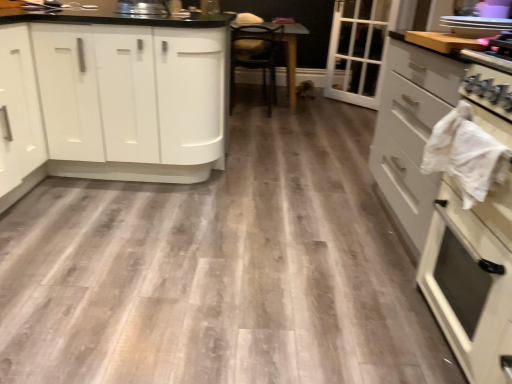
The height and width of the screenshot is (384, 512). I want to click on white glossy cabinets at left, which ranks as the 2th cabinetry in right-to-left order, so click(x=114, y=96).

You are a GUI agent. You are given a task and a screenshot of the screen. Output one action in this format:
    pyautogui.click(x=<x>, y=<y>)
    Task: Click on the white glossy oven at right, acting as the second cabinetry starting from the back
    
    Given the screenshot: What is the action you would take?
    pyautogui.click(x=443, y=207)

Image resolution: width=512 pixels, height=384 pixels. What do you see at coordinates (357, 50) in the screenshot?
I see `white glass door at upper right` at bounding box center [357, 50].

Locate an element on the screen. This screenshot has width=512, height=384. white glossy cabinets at left, the first cabinetry in the top-to-bottom sequence is located at coordinates (114, 96).

Is wooden table at center situated inside white glossy plates at upper right or outside?

wooden table at center cannot be found inside white glossy plates at upper right.

Does point (290, 79) lie in front of point (503, 31)?

No, it is not.

From the image's perspective, is wooden table at center positioned above or below white glossy plates at upper right?

Clearly, from the image's perspective, wooden table at center is above white glossy plates at upper right.

Considering the sizes of wooden table at center and white glossy plates at upper right in the image, is wooden table at center wider or thinner than white glossy plates at upper right?

Considering their sizes, wooden table at center looks broader than white glossy plates at upper right.

Is white glossy cabinets at left, the first cabinetry from the back, looking in the opposite direction of white glass door at upper right?

No, white glossy cabinets at left, the first cabinetry from the back, is not facing the opposite direction of white glass door at upper right.

Can you confirm if white glossy cabinets at left, the first cabinetry from the back, is wider than white glass door at upper right?

Indeed, white glossy cabinets at left, the first cabinetry from the back, has a greater width compared to white glass door at upper right.

Considering the relative sizes of white glossy cabinets at left, the first cabinetry from the back, and white glass door at upper right in the image provided, is white glossy cabinets at left, the first cabinetry from the back, taller than white glass door at upper right?

In fact, white glossy cabinets at left, the first cabinetry from the back, may be shorter than white glass door at upper right.

Consider the image. Measure the distance from white glossy cabinets at left, the second cabinetry ordered from the bottom, to white glass door at upper right.

The distance of white glossy cabinets at left, the second cabinetry ordered from the bottom, from white glass door at upper right is 9.10 feet.

Considering the positions of points (286, 47) and (209, 120), is point (286, 47) farther from camera compared to point (209, 120)?

Yes, point (286, 47) is farther from viewer.

From the picture: From the image's perspective, is wooden table at center on top of white glossy cabinets at left, the first cabinetry from the back?

Yes, from the image's perspective, wooden table at center is above white glossy cabinets at left, the first cabinetry from the back.

From a real-world perspective, who is located lower, wooden table at center or white glossy cabinets at left, which ranks as the 2th cabinetry in right-to-left order?

wooden table at center.

Is wooden table at center oriented away from white glossy cabinets at left, which ranks as the 2th cabinetry in right-to-left order?

No, wooden table at center's orientation is not away from white glossy cabinets at left, which ranks as the 2th cabinetry in right-to-left order.

Is white glass door at upper right positioned before white glossy plates at upper right?

No.

Is white glass door at upper right facing away from white glossy plates at upper right?

No, white glass door at upper right's orientation is not away from white glossy plates at upper right.

Is white glass door at upper right far from white glossy plates at upper right?

white glass door at upper right is positioned a significant distance from white glossy plates at upper right.

Considering the positions of objects white glass door at upper right and white glossy plates at upper right in the image provided, who is more to the left, white glass door at upper right or white glossy plates at upper right?

Positioned to the left is white glossy plates at upper right.

Is wooden table at center a part of white glossy oven at right, placed as the 1th cabinetry when sorted from front to back?

No, wooden table at center is not inside white glossy oven at right, placed as the 1th cabinetry when sorted from front to back.

Which object is thinner, white glossy oven at right, which is counted as the second cabinetry, starting from the top, or wooden table at center?

white glossy oven at right, which is counted as the second cabinetry, starting from the top, is thinner.

Is white glossy oven at right, acting as the second cabinetry starting from the back, not near wooden table at center?

Indeed, white glossy oven at right, acting as the second cabinetry starting from the back, is not near wooden table at center.

Considering the sizes of objects white glossy oven at right, which is counted as the second cabinetry, starting from the top, and wooden table at center in the image provided, who is shorter, white glossy oven at right, which is counted as the second cabinetry, starting from the top, or wooden table at center?

wooden table at center is shorter.

Is point (293, 33) positioned before point (332, 57)?

Yes, point (293, 33) is closer to viewer.

Image resolution: width=512 pixels, height=384 pixels. What are the coordinates of `table below the white glass door at upper right (from the image's perspective)` in the screenshot? It's located at (292, 58).

Which object is positioned more to the right, wooden table at center or white glass door at upper right?

Positioned to the right is white glass door at upper right.

Is wooden table at center positioned with its back to white glass door at upper right?

wooden table at center does not have its back to white glass door at upper right.

Can you confirm if white glass door at upper right is bigger than wooden table at center?

No, white glass door at upper right is not bigger than wooden table at center.

Considering the positions of point (367, 99) and point (286, 55), is point (367, 99) closer or farther from the camera than point (286, 55)?

Point (367, 99) appears to be farther away from the viewer than point (286, 55).

Is white glass door at upper right in front of or behind wooden table at center in the image?

Visually, white glass door at upper right is located behind wooden table at center.

Is white glass door at upper right positioned far away from wooden table at center?

No, white glass door at upper right is in close proximity to wooden table at center.

Where is `kitchen appliance in front of the wooden table at center`? kitchen appliance in front of the wooden table at center is located at coordinates (476, 26).

There is a white glass door at upper right. Where is `the 1st cabinetry below it (from a real-world perspective)`? the 1st cabinetry below it (from a real-world perspective) is located at coordinates (114, 96).

Based on their spatial positions, is white glossy plates at upper right or wooden table at center closer to white glossy cabinets at left, which ranks as the 2th cabinetry in right-to-left order?

white glossy plates at upper right is closer to white glossy cabinets at left, which ranks as the 2th cabinetry in right-to-left order.

Consider the image. Which object lies further to the anchor point wooden table at center, white glass door at upper right or white glossy cabinets at left, the 1th cabinetry positioned from the left?

Among the two, white glossy cabinets at left, the 1th cabinetry positioned from the left, is located further to wooden table at center.

Looking at the image, which one is located closer to white glossy cabinets at left, the second cabinetry ordered from the bottom, white glass door at upper right or wooden table at center?

Among the two, wooden table at center is located nearer to white glossy cabinets at left, the second cabinetry ordered from the bottom.

Which object lies further to the anchor point white glossy plates at upper right, white glass door at upper right or white glossy cabinets at left, which is the second cabinetry in front-to-back order?

white glass door at upper right is further to white glossy plates at upper right.

Considering their positions, is white glossy oven at right, acting as the second cabinetry starting from the back, positioned further to white glossy cabinets at left, which is the second cabinetry in front-to-back order, than white glossy plates at upper right?

white glossy plates at upper right lies further to white glossy cabinets at left, which is the second cabinetry in front-to-back order, than the other object.

Estimate the real-world distances between objects in this image. Which object is further from wooden table at center, white glossy cabinets at left, the first cabinetry in the top-to-bottom sequence, or white glass door at upper right?

white glossy cabinets at left, the first cabinetry in the top-to-bottom sequence, is further to wooden table at center.

Considering their positions, is white glossy plates at upper right positioned further to wooden table at center than white glossy cabinets at left, which ranks as the 2th cabinetry in right-to-left order?

Based on the image, white glossy plates at upper right appears to be further to wooden table at center.

From the image, which object appears to be farther from wooden table at center, white glossy cabinets at left, the first cabinetry in the top-to-bottom sequence, or white glossy oven at right, which is counted as the second cabinetry, starting from the top?

The object further to wooden table at center is white glossy oven at right, which is counted as the second cabinetry, starting from the top.

The height and width of the screenshot is (384, 512). Find the location of `table between white glossy plates at upper right and white glass door at upper right from front to back`. table between white glossy plates at upper right and white glass door at upper right from front to back is located at coordinates (292, 58).

The image size is (512, 384). I want to click on kitchen appliance between white glossy oven at right, placed as the 1th cabinetry when sorted from front to back, and wooden table at center, along the z-axis, so click(x=476, y=26).

You are a GUI agent. You are given a task and a screenshot of the screen. Output one action in this format:
    pyautogui.click(x=<x>, y=<y>)
    Task: Click on the cabinetry between white glossy oven at right, which is counted as the second cabinetry, starting from the top, and wooden table at center in the front-back direction
    The image size is (512, 384).
    Given the screenshot: What is the action you would take?
    tap(114, 96)

The height and width of the screenshot is (384, 512). I want to click on cabinetry between white glossy plates at upper right and wooden table at center from front to back, so click(114, 96).